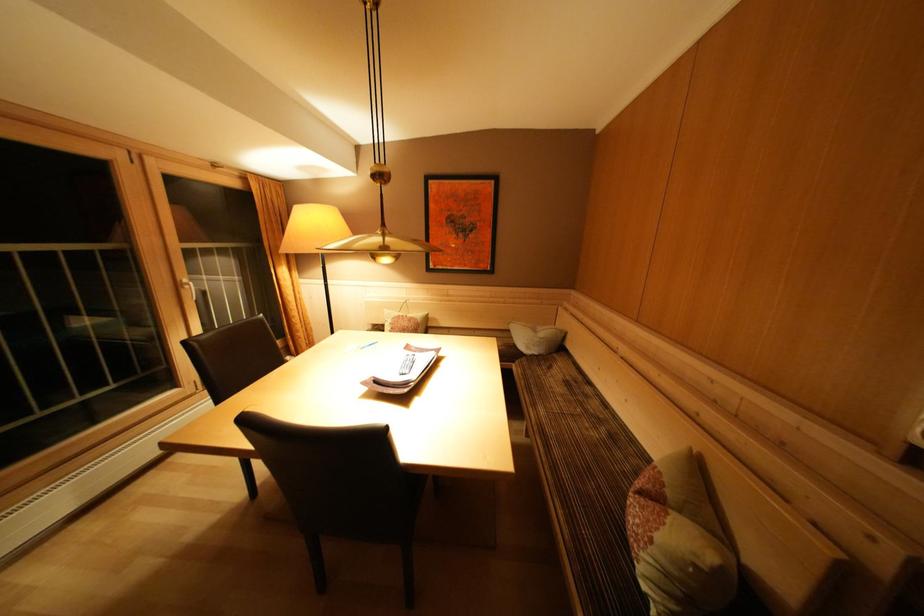
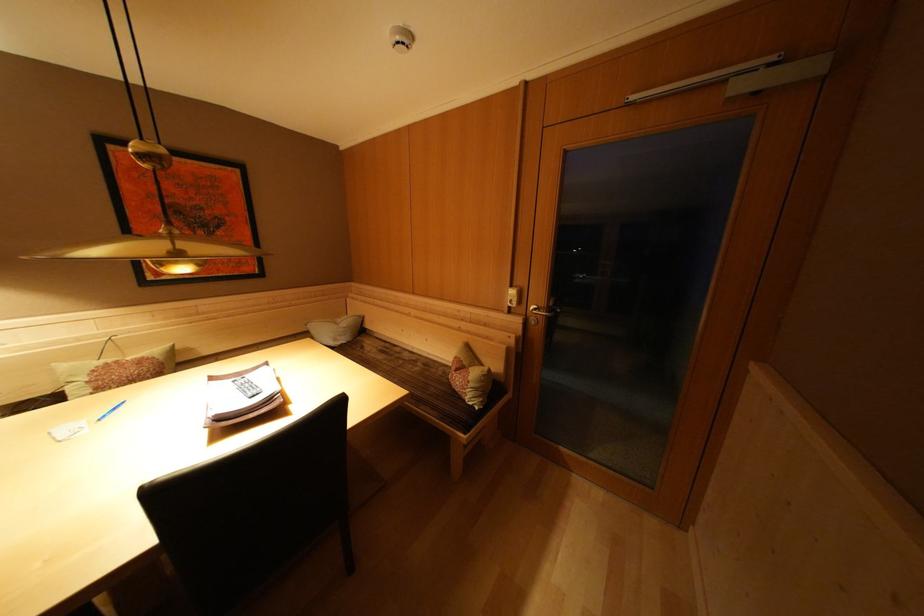
Question: The images are taken continuously from a first-person perspective. In which direction is your viewpoint rotating?

Choices:
 (A) Left
 (B) Right
 (C) Up
 (D) Down

Answer: (B)